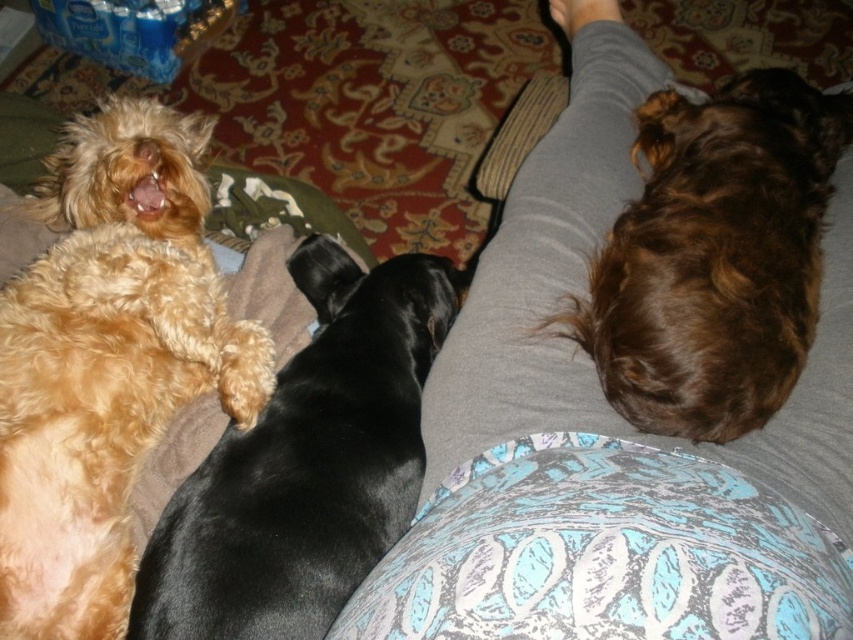
You are a dog owner who wants to place a new toy between the gray fabric at upper center and the golden fur dog at upper left. Based on their positions, where should you place the toy to ensure it is between them?

The gray fabric at upper center is to the right of the golden fur dog at upper left, so placing the toy between them would require positioning it to the right of the golden fur dog at upper left but to the left of the gray fabric at upper center.

You are a dog owner who wants to place a small toy between the three dogs on the couch. The toy has to be placed at point (610, 433). Where exactly on the couch will the toy land?

The toy will land on the gray fabric at upper center because point (610, 433) is located there.